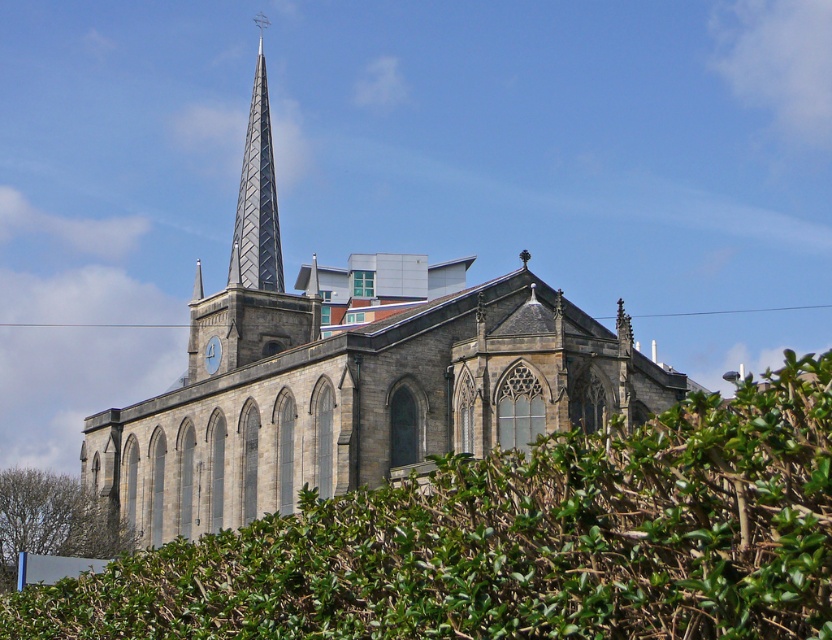
Does green leafy hedge at lower center appear on the left side of metallic diamond-patterned spire at center?

Incorrect, green leafy hedge at lower center is not on the left side of metallic diamond-patterned spire at center.

What do you see at coordinates (518, 541) in the screenshot? I see `green leafy hedge at lower center` at bounding box center [518, 541].

Image resolution: width=832 pixels, height=640 pixels. Identify the location of green leafy hedge at lower center. (518, 541).

Is point (255, 269) positioned behind point (11, 492)?

That is True.

Who is positioned more to the left, metallic diamond-patterned spire at center or green leafy tree at lower left?

Positioned to the left is green leafy tree at lower left.

Locate an element on the screen. The width and height of the screenshot is (832, 640). metallic diamond-patterned spire at center is located at coordinates (256, 195).

The image size is (832, 640). I want to click on metallic diamond-patterned spire at center, so click(x=256, y=195).

Locate an element on the screen. stone church at center is located at coordinates (350, 380).

Is stone church at center further to camera compared to metallic diamond-patterned spire at center?

No, stone church at center is closer to the viewer.

Does point (147, 448) come closer to viewer compared to point (256, 288)?

Yes, point (147, 448) is closer to viewer.

Where is `stone church at center`? Image resolution: width=832 pixels, height=640 pixels. stone church at center is located at coordinates (350, 380).